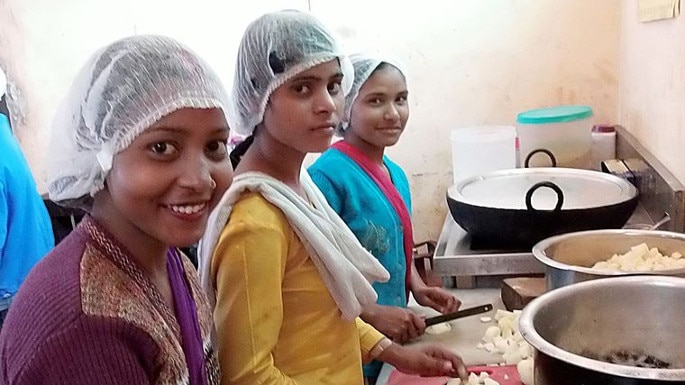
Identify the location of cooking pots. (555, 274), (544, 363).